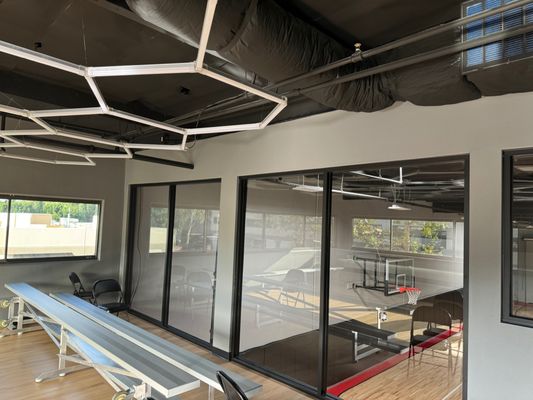
At what (x,y) coordinates should I click in order to perform the action: click on grey bench. Please return your answer as a coordinate pair (x, y). This screenshot has height=400, width=533. Looking at the image, I should click on (146, 367).